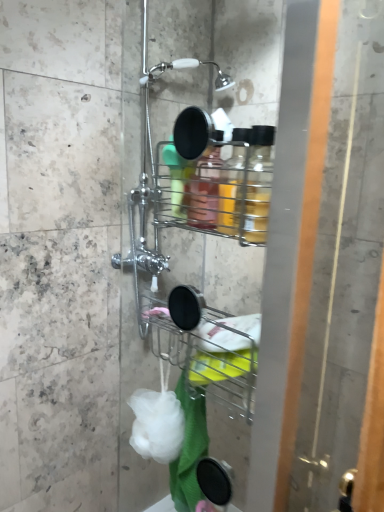
Question: From the image's perspective, is white soft bath towel at lower center located above transparent glass screen door at right?

Choices:
 (A) no
 (B) yes

Answer: (A)

Question: Is white soft bath towel at lower center positioned far away from transparent glass screen door at right?

Choices:
 (A) no
 (B) yes

Answer: (A)

Question: Does white soft bath towel at lower center have a smaller size compared to transparent glass screen door at right?

Choices:
 (A) no
 (B) yes

Answer: (B)

Question: From a real-world perspective, is white soft bath towel at lower center located higher than transparent glass screen door at right?

Choices:
 (A) yes
 (B) no

Answer: (B)

Question: From a real-world perspective, is white soft bath towel at lower center physically below transparent glass screen door at right?

Choices:
 (A) no
 (B) yes

Answer: (B)

Question: Considering the relative sizes of white soft bath towel at lower center and transparent glass screen door at right in the image provided, is white soft bath towel at lower center thinner than transparent glass screen door at right?

Choices:
 (A) no
 (B) yes

Answer: (B)

Question: From a real-world perspective, is transparent glass screen door at right on white soft bath towel at lower center?

Choices:
 (A) yes
 (B) no

Answer: (A)

Question: Can you confirm if transparent glass screen door at right is thinner than white soft bath towel at lower center?

Choices:
 (A) yes
 (B) no

Answer: (B)

Question: Does transparent glass screen door at right have a larger size compared to white soft bath towel at lower center?

Choices:
 (A) no
 (B) yes

Answer: (B)

Question: Is transparent glass screen door at right far away from white soft bath towel at lower center?

Choices:
 (A) no
 (B) yes

Answer: (A)

Question: Is transparent glass screen door at right smaller than white soft bath towel at lower center?

Choices:
 (A) yes
 (B) no

Answer: (B)

Question: From the image's perspective, is transparent glass screen door at right under white soft bath towel at lower center?

Choices:
 (A) no
 (B) yes

Answer: (A)

Question: Is transparent glass screen door at right closer to the viewer compared to white matte sponge at lower center?

Choices:
 (A) yes
 (B) no

Answer: (A)